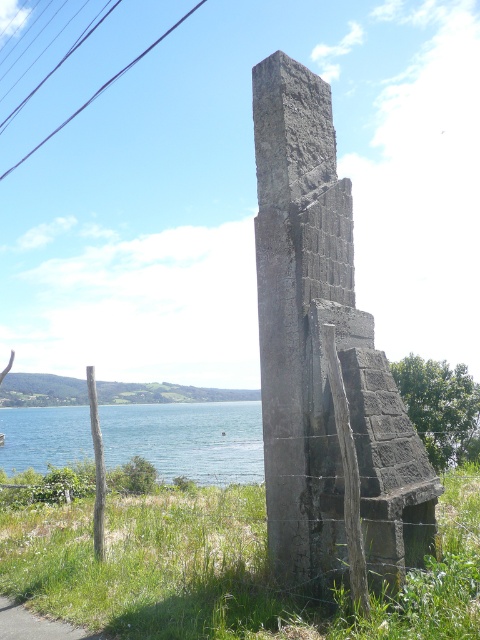
Based on the coordinates provided, where exactly is the gray stone monument at center located in the image?

The gray stone monument at center is located at point coordinates of (x=323, y=355).

You are a photographer planning to capture the gray stone monument at center and the blue water at lower left in a single shot. Based on their sizes, which object should you focus on to ensure both are clearly visible in the frame?

The gray stone monument at center is smaller in size compared to the blue water at lower left. To ensure both are clearly visible, focus on the gray stone monument at center first since it is smaller and might require more precise framing to capture its details while still including the larger blue water at lower left in the background.

You are standing at the edge of the blue water at lower left and want to reach the gray stone monument at center. Which direction should you walk to get closer to the monument?

You should walk towards the center from the blue water at lower left to reach the gray stone monument at center, as it is located at the center of the scene.